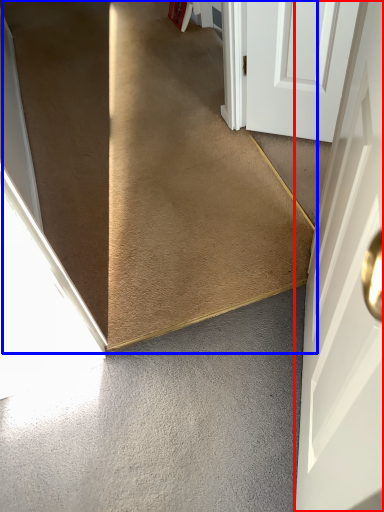
Question: Which object is closer to the camera taking this photo, door (highlighted by a red box) or stairs (highlighted by a blue box)?

Choices:
 (A) door
 (B) stairs

Answer: (A)